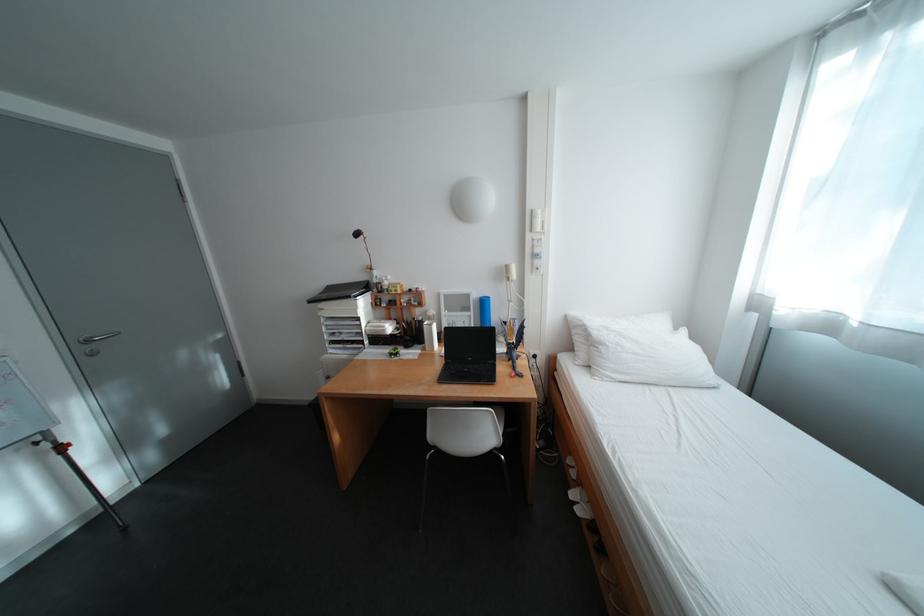
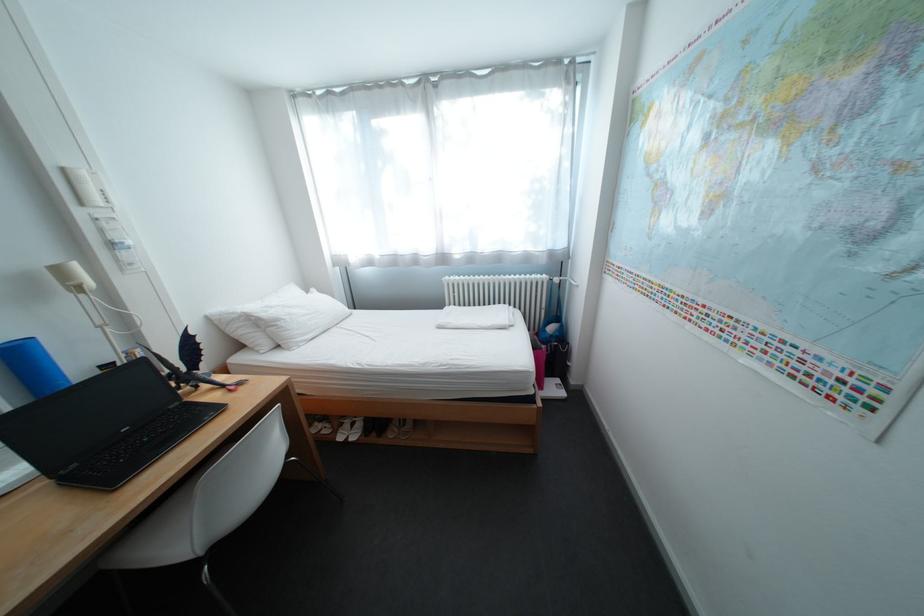
The point at (481, 360) is marked in the first image. Where is the corresponding point in the second image?

(137, 431)